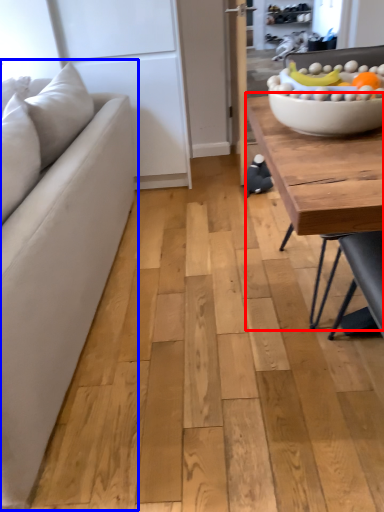
Question: Which object appears farthest to the camera in this image, coffee table (highlighted by a red box) or studio couch (highlighted by a blue box)?

Choices:
 (A) coffee table
 (B) studio couch

Answer: (A)